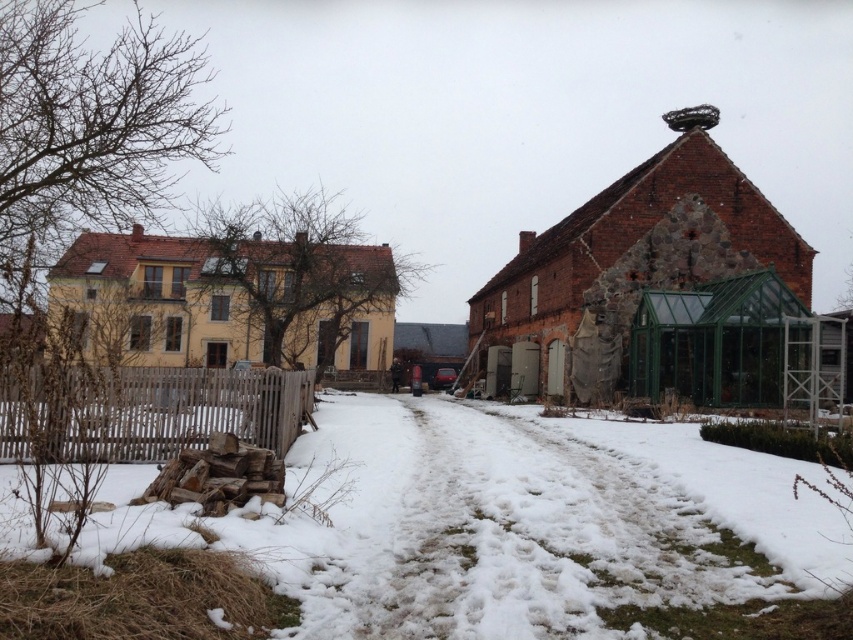
Between white fluffy snow at lower left and wooden picket fence at lower left, which one appears on the right side from the viewer's perspective?

white fluffy snow at lower left is more to the right.

Does point (564, 572) come in front of point (108, 396)?

That is True.

Identify the location of white fluffy snow at lower left. The height and width of the screenshot is (640, 853). (541, 529).